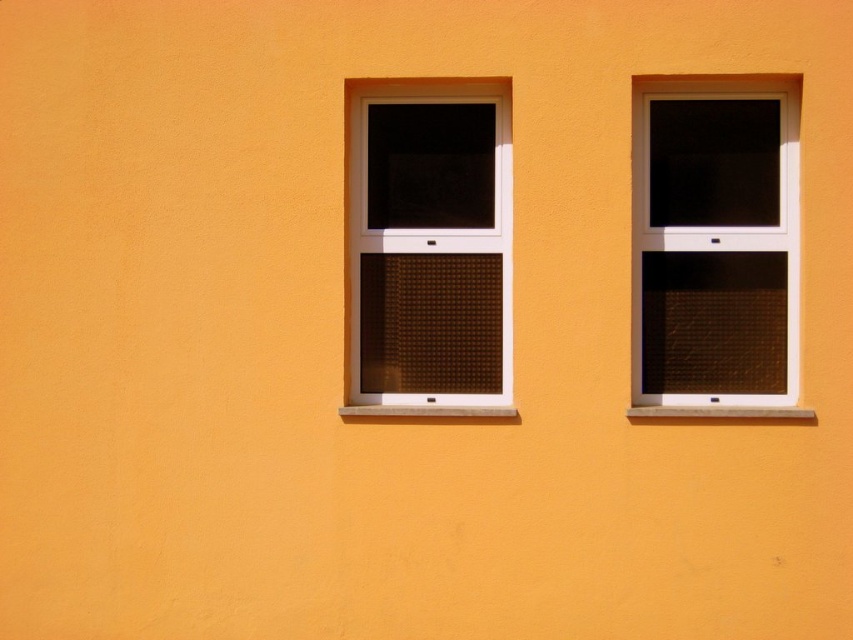
Question: Is matte white window at right wider than brown textured glass at center?

Choices:
 (A) yes
 (B) no

Answer: (A)

Question: Is matte white window at right bigger than brown textured glass at center?

Choices:
 (A) yes
 (B) no

Answer: (B)

Question: Which of the following is the farthest from the observer?

Choices:
 (A) matte white window at right
 (B) brown textured glass at center

Answer: (B)

Question: Which point is farther to the camera?

Choices:
 (A) (686, 122)
 (B) (474, 332)

Answer: (B)

Question: Does matte white window at right have a lesser width compared to brown textured glass at center?

Choices:
 (A) no
 (B) yes

Answer: (A)

Question: Among these points, which one is farthest from the camera?

Choices:
 (A) (383, 211)
 (B) (776, 138)

Answer: (A)